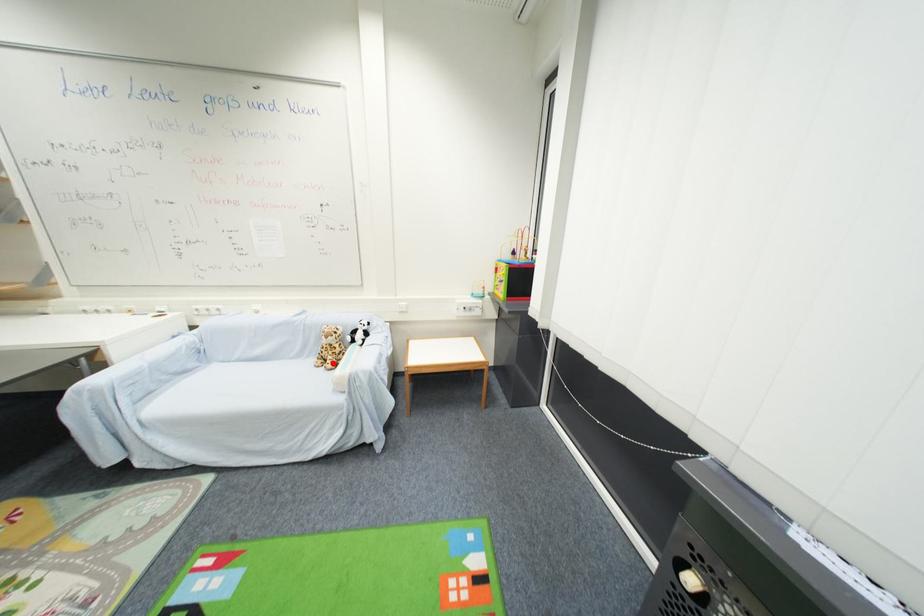
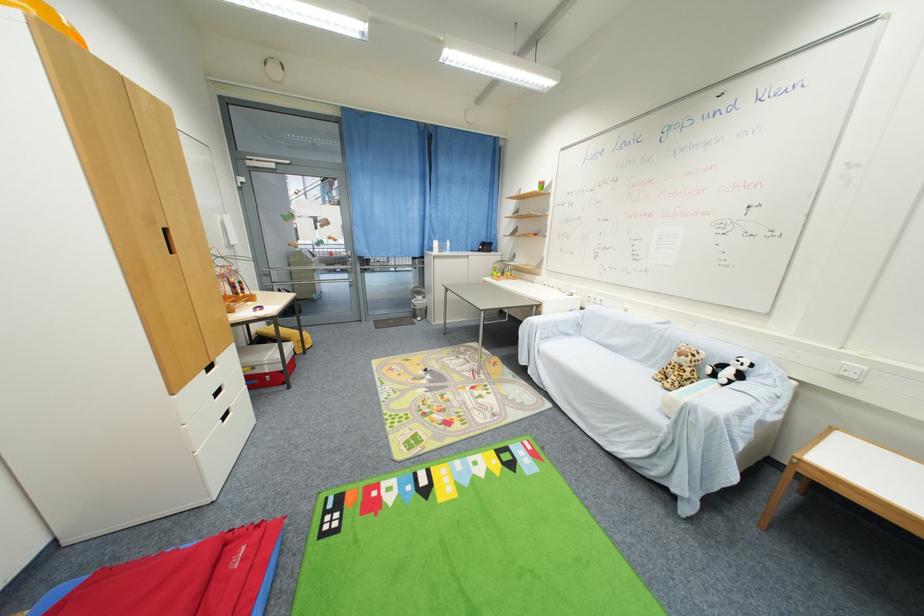
Question: I am providing you with two images of the same scene from different viewpoints. A red point is marked on the first image. Can you still see the location of the red point in image 2?

Choices:
 (A) Yes
 (B) No

Answer: (A)